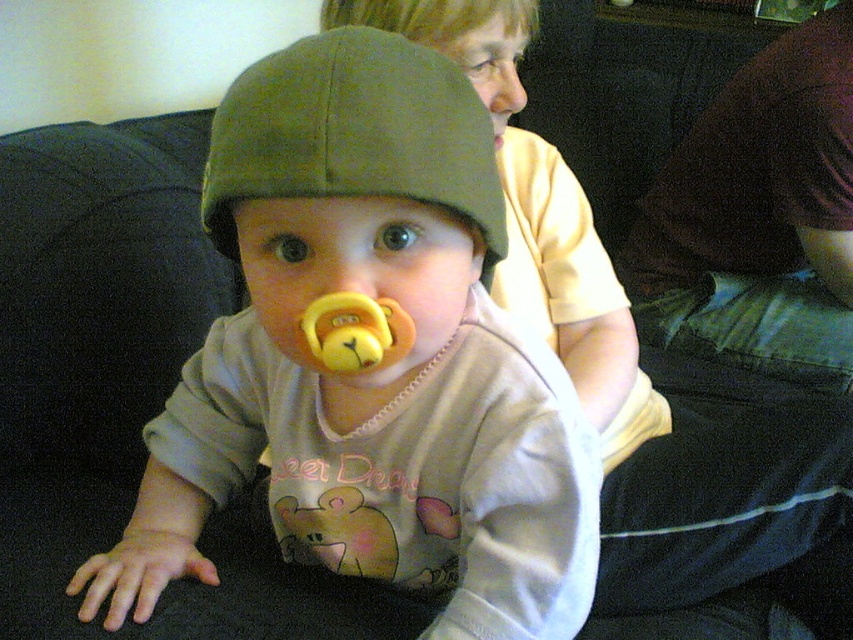
You are a photographer trying to capture a closeup of the yellow rubber pacifier at center while ensuring the light beige shirt at upper center remains visible in the background. Can you position yourself in a way that both the pacifier and the shirt are in focus?

The light beige shirt at upper center is further to the viewer than the yellow rubber pacifier at center, so if you position yourself closer to the pacifier, the shirt will be in the background and both can be in focus.

You are a photographer trying to capture a candid shot of the baby in the image. You notice two points marked in the scene. The first point is at coordinate point(x=791, y=209) and the second is at point(x=328, y=134). Which point is closer to the camera based on their positions?

Point(x=328, y=134) is closer to the camera than point(x=791, y=209) because the description states that point(x=791, y=209) is behind point(x=328, y=134).